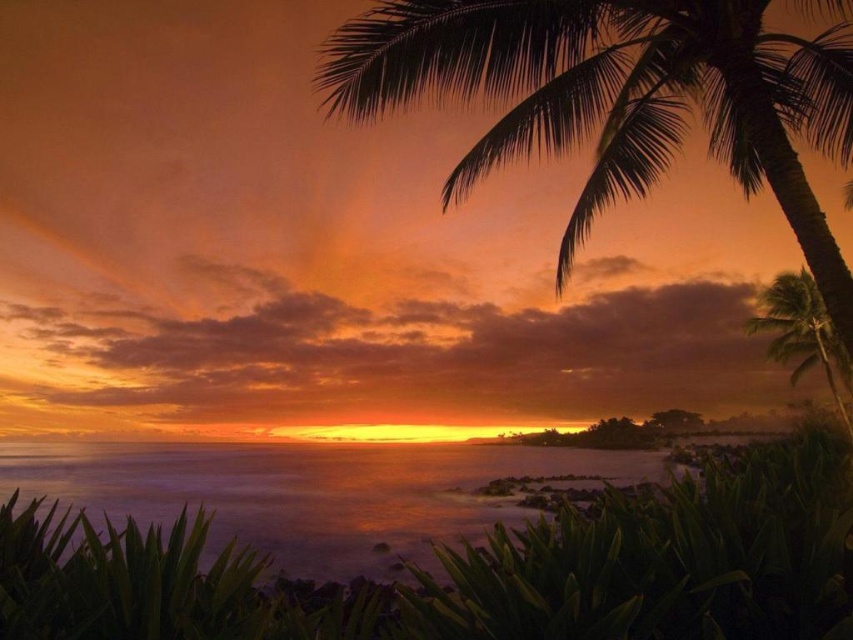
You are a photographer planning to capture the sunset with both the silhouette leafy palm at upper right and the green leafy palm tree at right in your frame. Based on their sizes, which palm tree should you focus on to ensure it takes up more space in your photo?

The silhouette leafy palm at upper right should be focused on because its width is larger than the green leafy palm tree at right, making it occupy more space in the photo.

Looking at this image, you are standing at the shore looking at the sunset. There are two points marked in the image. The first point is at coordinates point [76,484] and the second point is at point [804,337]. Which point is closer to you?

Point [76,484] is in front of point [804,337], so the first point is closer to you.

Looking at this image, you are a drone operator trying to capture a photo of the translucent water at center and the green leafy palm tree at right from above. The drone has a camera with a 30 feet wide lens. Can the drone capture both objects in one shot without moving?

The distance between the translucent water at center and the green leafy palm tree at right is 46.23 feet, which is wider than the drone camera lens width of 30 feet. Therefore, the drone cannot capture both objects in one shot without moving.